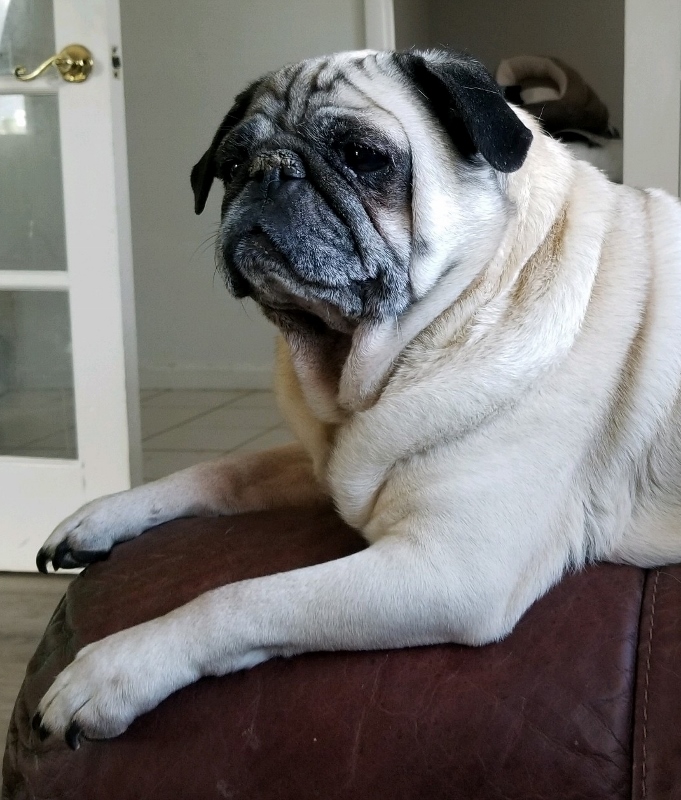
Locate an element on the screen. This screenshot has width=681, height=800. window is located at coordinates (22, 432).